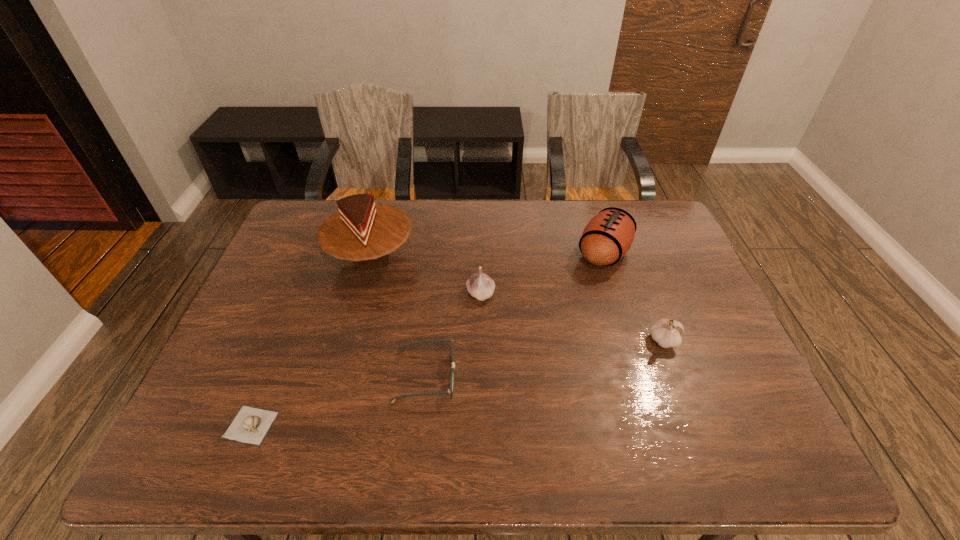
Identify which garlic is the closest to the third object from right to left. Please provide its 2D coordinates. Your answer should be formatted as a tuple, i.e. [(x, y)], where the tuple contains the x and y coordinates of a point satisfying the conditions above.

[(666, 332)]

I want to click on blank area in the image that satisfies the following two spatial constraints: 1. on the front side of the second garlic from right to left; 2. on the right side of the cake, so click(361, 294).

Where is `blank space that satisfies the following two spatial constraints: 1. on the back side of the football (American); 2. on the left side of the shortest object`? blank space that satisfies the following two spatial constraints: 1. on the back side of the football (American); 2. on the left side of the shortest object is located at coordinates (320, 253).

The height and width of the screenshot is (540, 960). I want to click on vacant area in the image that satisfies the following two spatial constraints: 1. on the front side of the football (American); 2. on the face of the spectacles, so click(x=641, y=376).